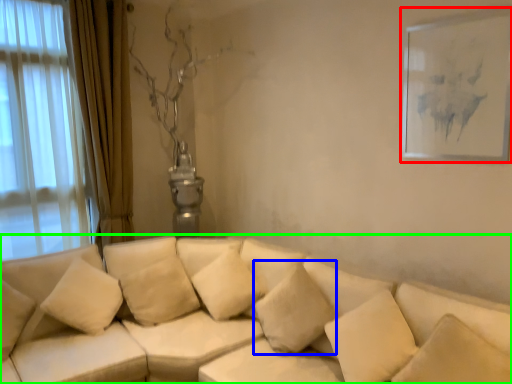
Question: Which object is positioned farthest from picture frame (highlighted by a red box)? Select from pillow (highlighted by a blue box) and studio couch (highlighted by a green box).

Choices:
 (A) pillow
 (B) studio couch

Answer: (B)